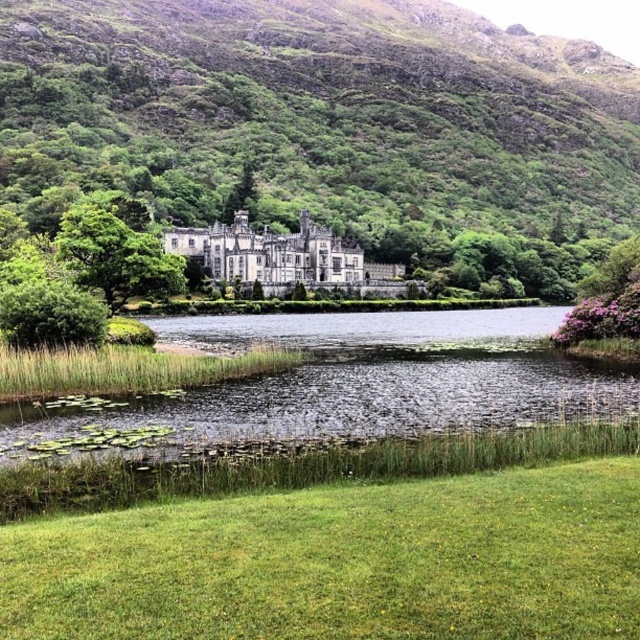
You are standing in front of the historic building and want to take a photo. You have two points marked on your camera screen to focus on. The first point is at coordinates point (241, 218) and the second is at point (180, 264). Which point is closer to you?

Point (241, 218) is further to the camera than point (180, 264), so the second point is closer to you.

You are standing on the stone castle at center and want to walk to the green leafy hillside at upper center. Which direction should you head?

You should head to the right to reach the green leafy hillside at upper center from the stone castle at center.

Based on the scene description, where is the green leafy hillside at upper center located in terms of its 2D coordinates?

The green leafy hillside at upper center is located at the 2D coordinates point (326, 125).